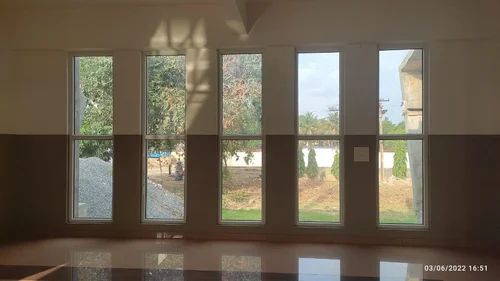
What are the coordinates of `window` in the screenshot? It's located at (315, 110).